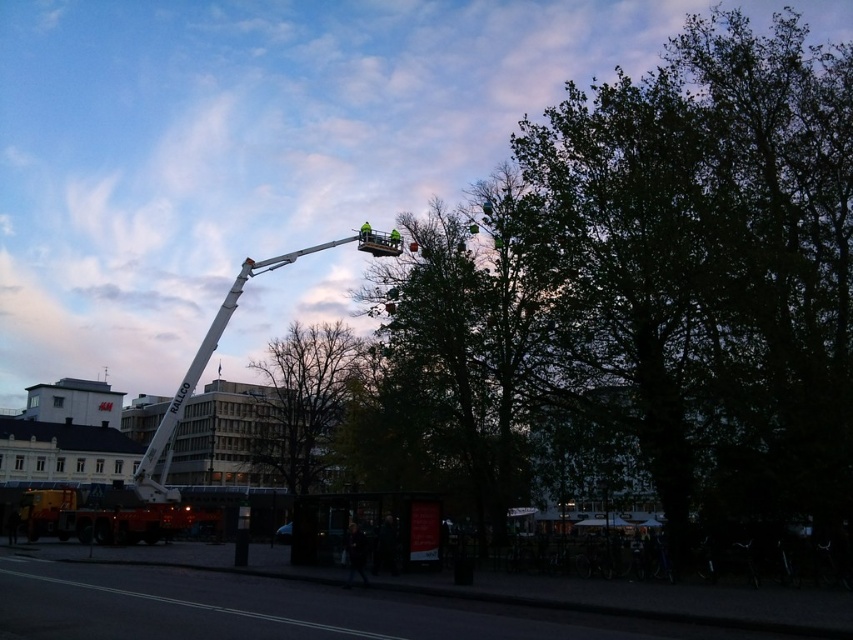
Question: Where is green leafy tree at upper center located in relation to white metallic crane at center in the image?

Choices:
 (A) right
 (B) left

Answer: (A)

Question: From the image, what is the correct spatial relationship of green leafy tree at upper center in relation to bare branches at center?

Choices:
 (A) left
 (B) right

Answer: (B)

Question: Which object is farther from the camera taking this photo?

Choices:
 (A) bare branches at center
 (B) green leafy tree at upper center

Answer: (A)

Question: Which of the following is the closest to the observer?

Choices:
 (A) (506, 324)
 (B) (165, 460)
 (C) (306, 385)

Answer: (A)

Question: Which point is closer to the camera?

Choices:
 (A) white metallic crane at center
 (B) green leafy tree at upper center

Answer: (B)

Question: Can you confirm if green leafy tree at upper center is positioned to the right of bare branches at center?

Choices:
 (A) no
 (B) yes

Answer: (B)